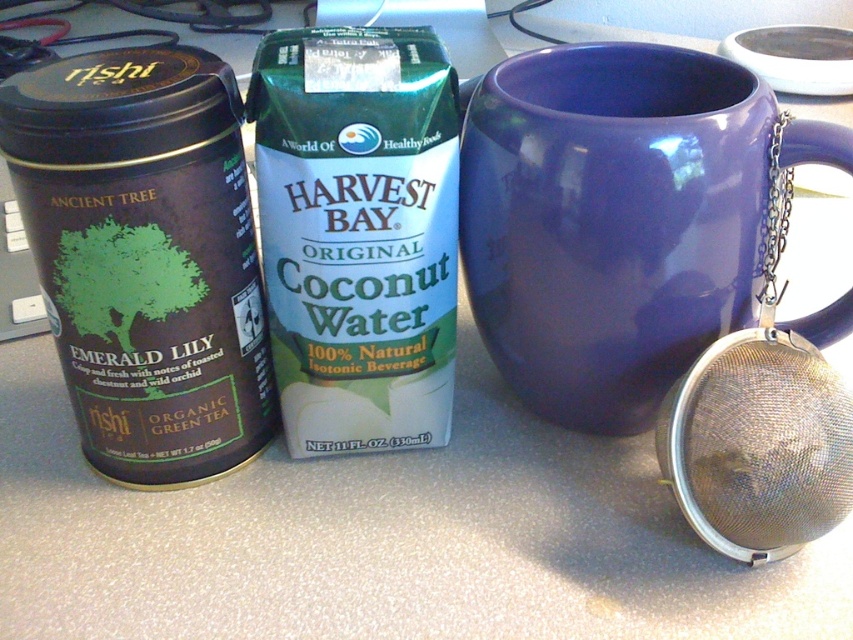
Does glossy ceramic mug at upper center come in front of matte black organic green tea can at left?

No, glossy ceramic mug at upper center is behind matte black organic green tea can at left.

Does point (630, 108) come farther from viewer compared to point (165, 340)?

Yes, it is.

Where is `glossy ceramic mug at upper center`? glossy ceramic mug at upper center is located at coordinates (611, 221).

Can you confirm if matte black organic green tea can at left is positioned above silver mesh strainer at right?

Correct, matte black organic green tea can at left is located above silver mesh strainer at right.

Find the location of a particular element. The width and height of the screenshot is (853, 640). matte black organic green tea can at left is located at coordinates (144, 257).

Between glossy ceramic mug at upper center and silver mesh strainer at right, which one appears on the right side from the viewer's perspective?

silver mesh strainer at right

Does point (575, 304) lie behind point (769, 448)?

Yes, point (575, 304) is farther from viewer.

Who is more forward, (830, 164) or (821, 529)?

Point (821, 529) is more forward.

You are a GUI agent. You are given a task and a screenshot of the screen. Output one action in this format:
    pyautogui.click(x=<x>, y=<y>)
    Task: Click on the glossy ceramic mug at upper center
    
    Given the screenshot: What is the action you would take?
    pyautogui.click(x=611, y=221)